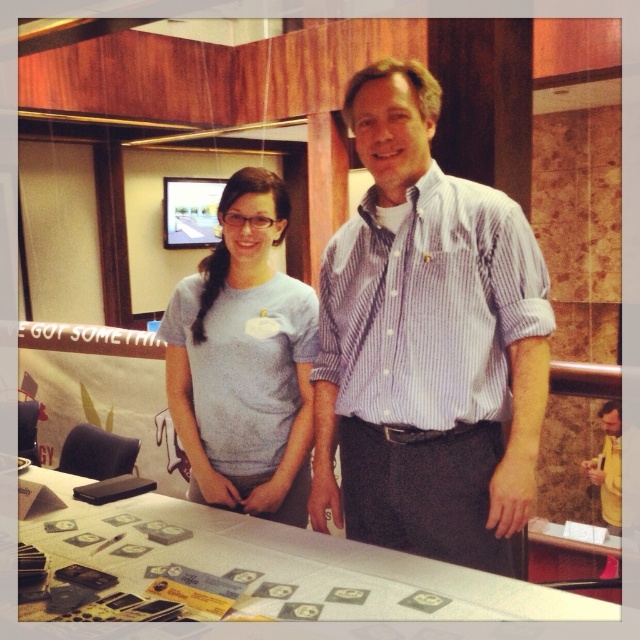
You are standing in front of the table where the two people are standing. There are two points marked on the table. The first point is at coordinate point (404, 392) and the second is at point (372, 582). Which point is closer to you?

Point (404, 392) is closer to you because it is further to the viewer than point (372, 582).

Please provide the 2D coordinates of the striped cotton shirt at center in the image. The coordinates should be in the format of a point with two decimal places, like this example format. Please do not add any extra information beyond the coordinates.

The 2D coordinates of the striped cotton shirt at center are at point (426, 344).